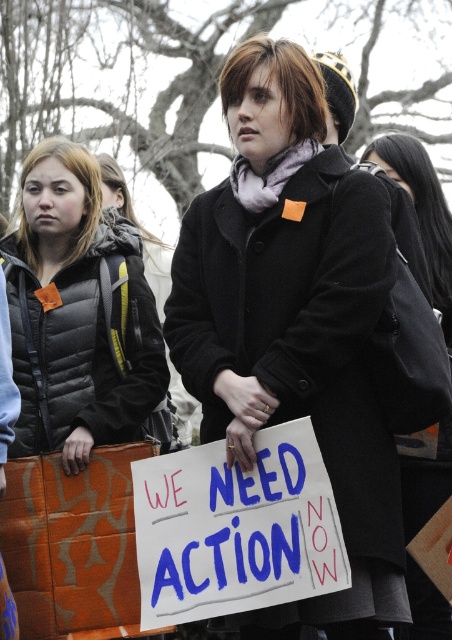
You are a photographer at the protest and want to capture a photo that includes both the black puffer jacket at left and the black wool coat at center. Which clothing item will appear closer to the camera in the photo?

The black puffer jacket at left will appear closer to the camera because it is further to the viewer than the black wool coat at center.

You are a photographer trying to capture both the black puffer jacket at left and the black quilted jacket at left in a single frame. Which jacket should you focus on first to ensure both are in the frame?

The black puffer jacket at left is shorter than the black quilted jacket at left, so you should focus on the black quilted jacket at left first to ensure both are in the frame.